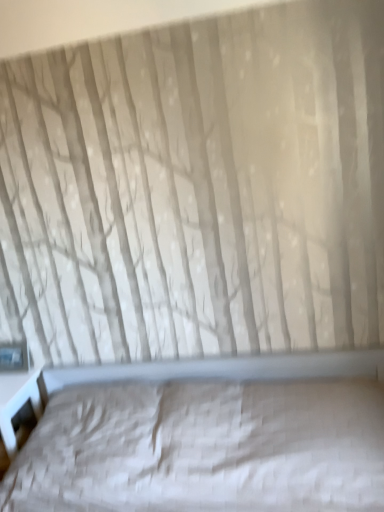
This screenshot has height=512, width=384. What do you see at coordinates (208, 436) in the screenshot? I see `white quilted bed at center` at bounding box center [208, 436].

At what (x,y) coordinates should I click in order to perform the action: click on white quilted bed at center. Please return your answer as a coordinate pair (x, y). Looking at the image, I should click on (208, 436).

Identify the location of transparent glass window at lower left. (14, 356).

What is the approximate width of transparent glass window at lower left?

It is 2.18 inches.

Describe the element at coordinates (14, 356) in the screenshot. I see `transparent glass window at lower left` at that location.

This screenshot has width=384, height=512. Find the location of `white quilted bed at center`. white quilted bed at center is located at coordinates (208, 436).

Considering the positions of objects transparent glass window at lower left and white quilted bed at center in the image provided, who is more to the right, transparent glass window at lower left or white quilted bed at center?

Answer: white quilted bed at center is more to the right.

In the image, is transparent glass window at lower left positioned in front of or behind white quilted bed at center?

transparent glass window at lower left is behind white quilted bed at center.

Is point (19, 354) closer or farther from the camera than point (335, 490)?

Point (19, 354) is farther from the camera than point (335, 490).

From the image's perspective, relative to white quilted bed at center, is transparent glass window at lower left above or below?

transparent glass window at lower left is above white quilted bed at center.

From a real-world perspective, who is located higher, transparent glass window at lower left or white quilted bed at center?

In real-world perspective, transparent glass window at lower left is above.

In the scene shown: Is transparent glass window at lower left thinner than white quilted bed at center?

Yes.

Is transparent glass window at lower left taller or shorter than white quilted bed at center?

transparent glass window at lower left is shorter than white quilted bed at center.

Which of these two, transparent glass window at lower left or white quilted bed at center, is bigger?

Bigger between the two is white quilted bed at center.

Is transparent glass window at lower left not inside white quilted bed at center?

transparent glass window at lower left lies outside white quilted bed at center's area.

Is transparent glass window at lower left far from white quilted bed at center?

No, transparent glass window at lower left is in close proximity to white quilted bed at center.

Is transparent glass window at lower left looking in the opposite direction of white quilted bed at center?

No, transparent glass window at lower left is not facing away from white quilted bed at center.

How different are the orientations of transparent glass window at lower left and white quilted bed at center in degrees?

The facing directions of transparent glass window at lower left and white quilted bed at center are 2.06 degrees apart.

You are a GUI agent. You are given a task and a screenshot of the screen. Output one action in this format:
    pyautogui.click(x=<x>, y=<y>)
    Task: Click on the window above the white quilted bed at center (from a real-world perspective)
    Image resolution: width=384 pixels, height=512 pixels.
    Given the screenshot: What is the action you would take?
    pyautogui.click(x=14, y=356)

Considering the relative positions of white quilted bed at center and transparent glass window at lower left in the image provided, is white quilted bed at center to the left of transparent glass window at lower left from the viewer's perspective?

No.

Who is more distant, white quilted bed at center or transparent glass window at lower left?

Positioned behind is transparent glass window at lower left.

Is point (341, 455) closer to camera compared to point (19, 366)?

Yes, point (341, 455) is in front of point (19, 366).

From the image's perspective, which object appears higher, white quilted bed at center or transparent glass window at lower left?

transparent glass window at lower left.

From a real-world perspective, which object stands above the other?

From a 3D spatial view, transparent glass window at lower left is above.

Which object is wider, white quilted bed at center or transparent glass window at lower left?

white quilted bed at center.

Does white quilted bed at center have a lesser height compared to transparent glass window at lower left?

No.

Is white quilted bed at center smaller than transparent glass window at lower left?

No.

Would you say white quilted bed at center is inside or outside transparent glass window at lower left?

white quilted bed at center is located beyond the bounds of transparent glass window at lower left.

Is the surface of white quilted bed at center in direct contact with transparent glass window at lower left?

There is a gap between white quilted bed at center and transparent glass window at lower left.

From the picture: Is white quilted bed at center oriented towards transparent glass window at lower left?

No.

What's the angular difference between white quilted bed at center and transparent glass window at lower left's facing directions?

The facing directions of white quilted bed at center and transparent glass window at lower left are 2.06 degrees apart.

I want to click on window above the white quilted bed at center (from a real-world perspective), so (x=14, y=356).

Locate an element on the screen. The image size is (384, 512). bed located underneath the transparent glass window at lower left (from a real-world perspective) is located at coordinates (208, 436).

The width and height of the screenshot is (384, 512). Find the location of `window behind the white quilted bed at center`. window behind the white quilted bed at center is located at coordinates (14, 356).